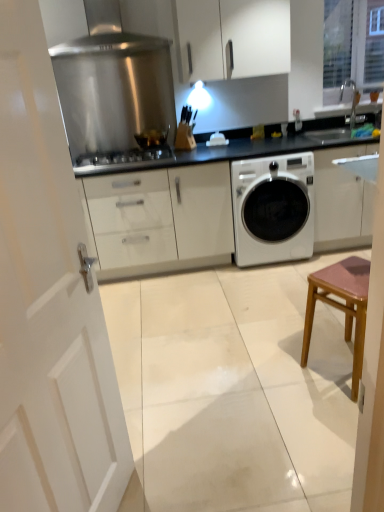
The width and height of the screenshot is (384, 512). I want to click on free spot above pink wood stool at right (from a real-world perspective), so click(345, 272).